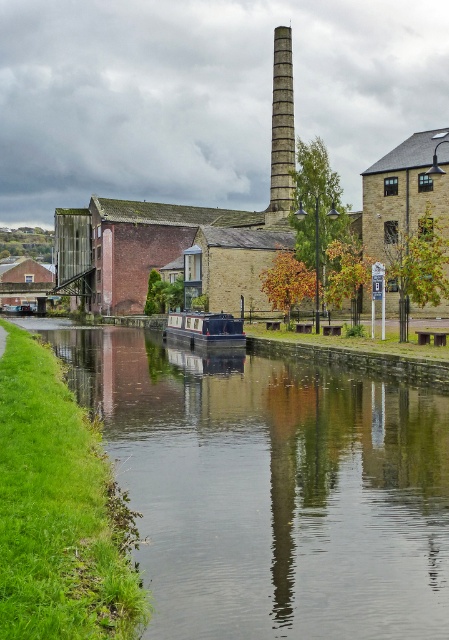
You are standing at the point closest to the viewer in the canal scene. Which point, point (x=115, y=442) or point (x=282, y=64), are you standing at?

You are standing at point (x=115, y=442) because it is in front of point (x=282, y=64).

You are standing at the point marked as point (271, 488) in the image. What type of surface are you currently standing on?

You are standing on the smooth concrete canal at center located at point (271, 488).

You are a delivery person trying to navigate a narrow path between the smooth concrete canal at center and the polished dark blue boat at center. Can you pass through the space between them?

The smooth concrete canal at center is positioned under the polished dark blue boat at center, so there is no space between them for the delivery person to pass through.